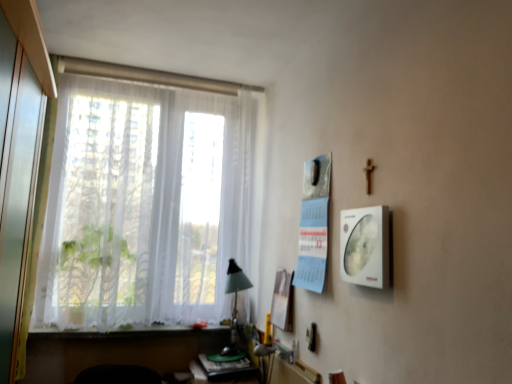
Measure the distance between white paper calendar at upper right, positioned as the 1th poster page in right-to-left order, and camera.

They are 5.68 feet apart.

This screenshot has height=384, width=512. Identify the location of wooden table at lower center. (223, 371).

Is transparent glass screen door at left thinner than white sheer curtains at left?

Indeed, transparent glass screen door at left has a lesser width compared to white sheer curtains at left.

Does transparent glass screen door at left have a smaller size compared to white sheer curtains at left?

Yes.

How much distance is there between transparent glass screen door at left and white sheer curtains at left?

30.91 inches.

Is point (288, 282) behind point (105, 107)?

No, (288, 282) is closer to viewer.

Is white sheer curtains at left inside white paper at center, which is the second poster page from right to left?

No, white sheer curtains at left is not a part of white paper at center, which is the second poster page from right to left.

Does white paper at center, marked as the 1th poster page in a bottom-to-top arrangement, turn towards white sheer curtains at left?

No, white paper at center, marked as the 1th poster page in a bottom-to-top arrangement, is not oriented towards white sheer curtains at left.

How much distance is there between wooden table at lower center and transparent glass screen door at left?

wooden table at lower center and transparent glass screen door at left are 1.19 meters apart from each other.

Is wooden table at lower center wider or thinner than transparent glass screen door at left?

Clearly, wooden table at lower center has more width compared to transparent glass screen door at left.

From the image's perspective, does wooden table at lower center appear lower than transparent glass screen door at left?

Correct, wooden table at lower center appears lower than transparent glass screen door at left in the image.

Identify the location of table that is under the transparent glass screen door at left (from a real-world perspective). The width and height of the screenshot is (512, 384). (223, 371).

Which is closer to the camera, [55,322] or [290,321]?

The point [290,321] is more forward.

From a real-world perspective, between white sheer curtains at left and white paper at center, positioned as the first poster page in back-to-front order, who is vertically lower?

white paper at center, positioned as the first poster page in back-to-front order, from a real-world perspective.

Does white sheer curtains at left have a lesser height compared to white paper at center, which is counted as the 1th poster page, starting from the left?

In fact, white sheer curtains at left may be taller than white paper at center, which is counted as the 1th poster page, starting from the left.

From the image's perspective, is white sheer curtains at left beneath white paper at center, acting as the second poster page starting from the front?

Incorrect, from the image's perspective, white sheer curtains at left is higher than white paper at center, acting as the second poster page starting from the front.

From the image's perspective, starting from the white sheer curtains at left, which poster page is the 1st one below? Please provide its 2D coordinates.

[(314, 224)]

How distant is white paper calendar at upper right, placed as the 2th poster page when sorted from bottom to top, from white sheer curtains at left?

white paper calendar at upper right, placed as the 2th poster page when sorted from bottom to top, is 38.45 inches from white sheer curtains at left.

Considering the relative positions of white paper calendar at upper right, arranged as the 2th poster page when viewed from the back, and white sheer curtains at left in the image provided, is white paper calendar at upper right, arranged as the 2th poster page when viewed from the back, to the left of white sheer curtains at left from the viewer's perspective?

No, white paper calendar at upper right, arranged as the 2th poster page when viewed from the back, is not to the left of white sheer curtains at left.

Is white paper calendar at upper right, positioned as the 1th poster page in right-to-left order, looking in the opposite direction of white sheer curtains at left?

No, white paper calendar at upper right, positioned as the 1th poster page in right-to-left order, is not facing the opposite direction of white sheer curtains at left.

Is white matte window sill at lower left at the right side of transparent glass screen door at left?

Yes.

Is white matte window sill at lower left next to transparent glass screen door at left?

No.

Considering the sizes of white matte window sill at lower left and transparent glass screen door at left in the image, is white matte window sill at lower left taller or shorter than transparent glass screen door at left?

In the image, white matte window sill at lower left appears to be shorter than transparent glass screen door at left.

What's the angular difference between white matte window sill at lower left and transparent glass screen door at left's facing directions?

The angular difference between white matte window sill at lower left and transparent glass screen door at left is 16.1 degrees.

Which is in front, point (32, 106) or point (277, 303)?

Point (32, 106)

Is transparent glass screen door at left not near white paper at center, positioned as the first poster page in back-to-front order?

Yes, transparent glass screen door at left is far from white paper at center, positioned as the first poster page in back-to-front order.

In the image, is transparent glass screen door at left on the left side or the right side of white paper at center, which is the second poster page from right to left?

In the image, transparent glass screen door at left appears on the left side of white paper at center, which is the second poster page from right to left.

Is transparent glass screen door at left taller than white paper at center, the 2th poster page from the top?

Correct, transparent glass screen door at left is much taller as white paper at center, the 2th poster page from the top.

Locate an element on the screen. This screenshot has width=512, height=384. screen door that is below the white sheer curtains at left (from the image's perspective) is located at coordinates (18, 203).

The height and width of the screenshot is (384, 512). Find the location of `the 1st poster page to the right of the white sheer curtains at left, starting your count from the anchor`. the 1st poster page to the right of the white sheer curtains at left, starting your count from the anchor is located at coordinates (283, 301).

When comparing their distances from white paper calendar at upper right, positioned as the 1th poster page in right-to-left order, does transparent glass screen door at left or white matte window sill at lower left seem closer?

Among the two, white matte window sill at lower left is located nearer to white paper calendar at upper right, positioned as the 1th poster page in right-to-left order.

Considering their positions, is white sheer curtains at left positioned further to white paper at center, acting as the second poster page starting from the front, than white glossy picture frame at right?

white sheer curtains at left.

When comparing their distances from white matte window sill at lower left, does white paper calendar at upper right, marked as the 2th poster page in a left-to-right arrangement, or wooden table at lower center seem further?

The object further to white matte window sill at lower left is white paper calendar at upper right, marked as the 2th poster page in a left-to-right arrangement.

Considering their positions, is white sheer curtains at left positioned further to white glossy picture frame at right than white matte window sill at lower left?

Among the two, white matte window sill at lower left is located further to white glossy picture frame at right.

Which object lies further to the anchor point white glossy picture frame at right, wooden table at lower center or white sheer curtains at left?

white sheer curtains at left is positioned further to the anchor white glossy picture frame at right.

When comparing their distances from white matte window sill at lower left, does white sheer curtains at left or wooden table at lower center seem closer?

wooden table at lower center is positioned closer to the anchor white matte window sill at lower left.

Based on their spatial positions, is white glossy picture frame at right or white sheer curtains at left further from white matte window sill at lower left?

white glossy picture frame at right is positioned further to the anchor white matte window sill at lower left.

Considering their positions, is white glossy picture frame at right positioned closer to transparent glass screen door at left than wooden table at lower center?

white glossy picture frame at right.

Identify the location of window located between white matte window sill at lower left and white paper at center, acting as the second poster page starting from the front, in the left-right direction. Image resolution: width=512 pixels, height=384 pixels. (143, 202).

The height and width of the screenshot is (384, 512). What are the coordinates of `window sill between white sheer curtains at left and wooden table at lower center in the up-down direction` in the screenshot? It's located at (136, 333).

In order to click on poster page situated between transparent glass screen door at left and white paper calendar at upper right, marked as the 2th poster page in a left-to-right arrangement, from left to right in this screenshot , I will do `click(283, 301)`.

You are a GUI agent. You are given a task and a screenshot of the screen. Output one action in this format:
    pyautogui.click(x=<x>, y=<y>)
    Task: Click on the table between transparent glass screen door at left and white paper at center, which is counted as the 1th poster page, starting from the left, from left to right
    This screenshot has height=384, width=512.
    Given the screenshot: What is the action you would take?
    pyautogui.click(x=223, y=371)